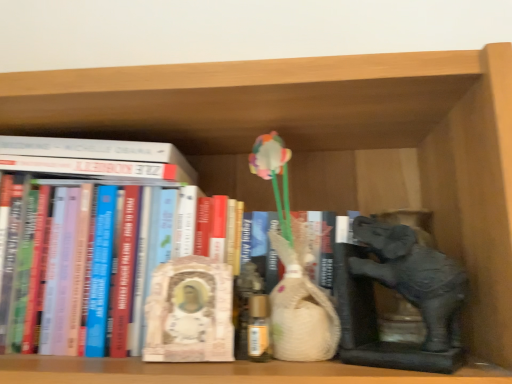
Question: Considering the relative sizes of matte gray elephant at right and hardcover book at center, the first book from the bottom, in the image provided, is matte gray elephant at right smaller than hardcover book at center, the first book from the bottom,?

Choices:
 (A) no
 (B) yes

Answer: (B)

Question: From a real-world perspective, is matte gray elephant at right beneath hardcover book at center, the first book from the bottom?

Choices:
 (A) no
 (B) yes

Answer: (B)

Question: From the image's perspective, is matte gray elephant at right located above hardcover book at center, the first book from the bottom?

Choices:
 (A) no
 (B) yes

Answer: (A)

Question: Does matte gray elephant at right have a lesser width compared to hardcover book at center, the first book from the bottom?

Choices:
 (A) yes
 (B) no

Answer: (A)

Question: Is matte gray elephant at right at the right side of hardcover book at center, which appears as the second book when viewed from the top?

Choices:
 (A) yes
 (B) no

Answer: (A)

Question: In the image, is white matte book at upper left, the second book positioned from the bottom, positioned in front of or behind matte gray elephant at right?

Choices:
 (A) front
 (B) behind

Answer: (B)

Question: Based on their sizes in the image, would you say white matte book at upper left, which appears as the 1th book when viewed from the top, is bigger or smaller than matte gray elephant at right?

Choices:
 (A) small
 (B) big

Answer: (B)

Question: Is white matte book at upper left, which appears as the 1th book when viewed from the top, inside or outside of matte gray elephant at right?

Choices:
 (A) outside
 (B) inside

Answer: (A)

Question: From the image's perspective, relative to matte gray elephant at right, is white matte book at upper left, which appears as the 1th book when viewed from the top, above or below?

Choices:
 (A) above
 (B) below

Answer: (A)

Question: Considering their positions, is matte gray elephant at right located in front of or behind white marble statue at center?

Choices:
 (A) behind
 (B) front

Answer: (B)

Question: In terms of width, does matte gray elephant at right look wider or thinner when compared to white marble statue at center?

Choices:
 (A) thin
 (B) wide

Answer: (B)

Question: Is point (453, 334) closer or farther from the camera than point (197, 354)?

Choices:
 (A) farther
 (B) closer

Answer: (B)

Question: From the image's perspective, is matte gray elephant at right above or below white marble statue at center?

Choices:
 (A) below
 (B) above

Answer: (B)

Question: Considering their positions, is white marble statue at center located in front of or behind matte gray elephant at right?

Choices:
 (A) front
 (B) behind

Answer: (B)

Question: Considering the positions of white marble statue at center and matte gray elephant at right in the image, is white marble statue at center bigger or smaller than matte gray elephant at right?

Choices:
 (A) small
 (B) big

Answer: (A)